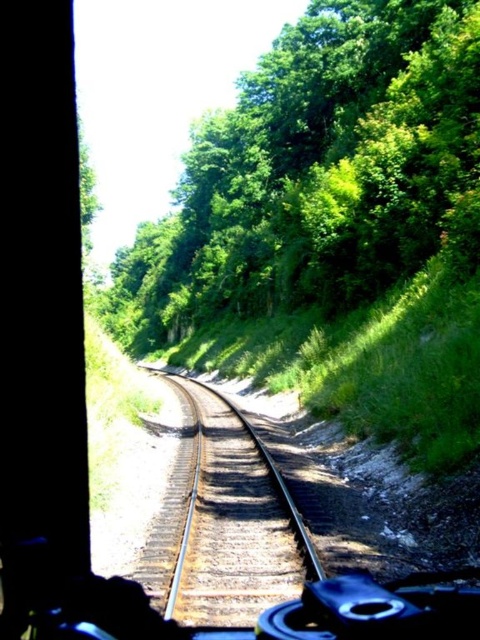
Question: Is green leafy trees at upper center to the right of metal/smooth train tracks at center from the viewer's perspective?

Choices:
 (A) no
 (B) yes

Answer: (A)

Question: In this image, where is green leafy trees at upper center located relative to metal/smooth train tracks at center?

Choices:
 (A) above
 (B) below

Answer: (A)

Question: Which point appears closest to the camera in this image?

Choices:
 (A) (419, 228)
 (B) (154, 545)

Answer: (B)

Question: Which of the following is the closest to the observer?

Choices:
 (A) green leafy trees at upper center
 (B) metal/smooth train tracks at center

Answer: (B)

Question: Is green leafy trees at upper center further to the viewer compared to metal/smooth train tracks at center?

Choices:
 (A) no
 (B) yes

Answer: (B)